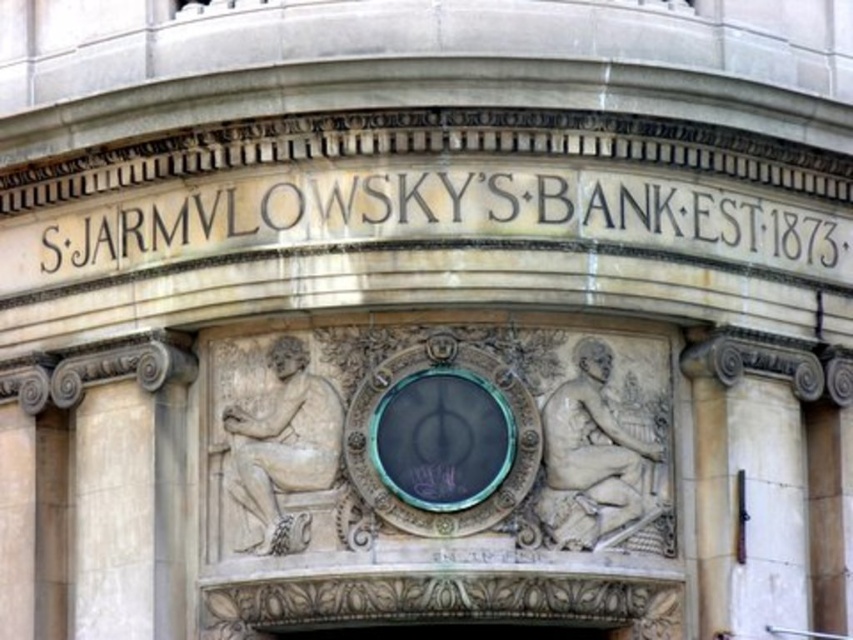
Question: Is green glass clock at center below black glass door at center?

Choices:
 (A) no
 (B) yes

Answer: (A)

Question: Is green glass clock at center to the left of white marble sculpture at center from the viewer's perspective?

Choices:
 (A) no
 (B) yes

Answer: (B)

Question: Which point is closer to the camera?

Choices:
 (A) (300, 634)
 (B) (619, 460)
 (C) (440, 445)

Answer: (C)

Question: Considering the relative positions of white marble sculpture at center and white marble statue at center in the image provided, where is white marble sculpture at center located with respect to white marble statue at center?

Choices:
 (A) right
 (B) left

Answer: (A)

Question: Estimate the real-world distances between objects in this image. Which object is closer to the white marble sculpture at center?

Choices:
 (A) white marble statue at center
 (B) black glass door at center

Answer: (B)

Question: Which is farther from the black glass door at center?

Choices:
 (A) white marble statue at center
 (B) green glass clock at center
 (C) white marble sculpture at center

Answer: (A)